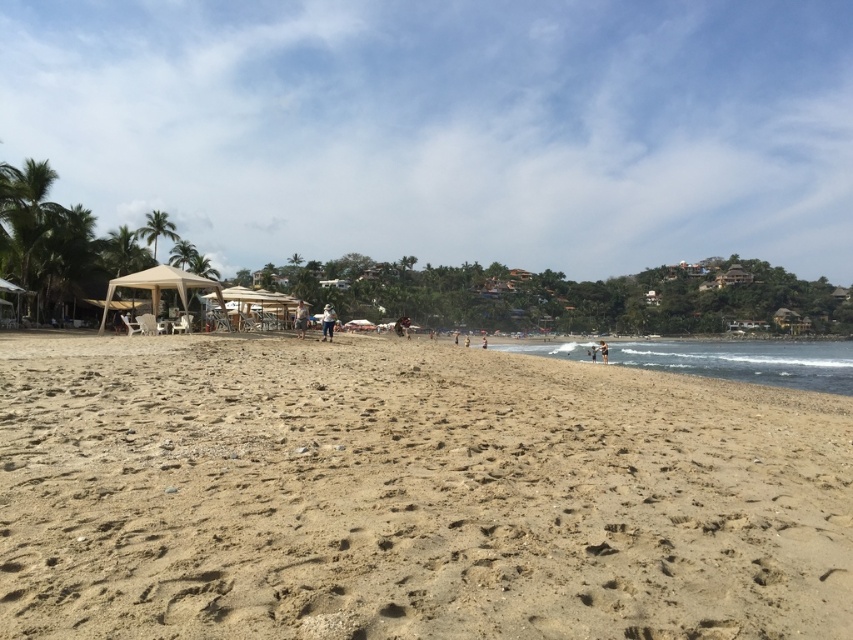
Question: In this image, where is light brown sand at center located relative to brown fabric umbrella at center?

Choices:
 (A) below
 (B) above

Answer: (B)

Question: Which object appears closest to the camera in this image?

Choices:
 (A) tan skin person at lower right
 (B) brown fabric umbrella at center
 (C) light brown sand at center

Answer: (B)

Question: Among these points, which one is farthest from the camera?

Choices:
 (A) (602, 344)
 (B) (331, 324)

Answer: (A)

Question: Does brown sandy beach at center have a smaller size compared to light brown sand at center?

Choices:
 (A) yes
 (B) no

Answer: (A)

Question: Is brown sandy beach at center smaller than tan skin person at lower right?

Choices:
 (A) no
 (B) yes

Answer: (B)

Question: Which of the following is the farthest from the observer?

Choices:
 (A) (302, 314)
 (B) (724, 440)
 (C) (328, 330)

Answer: (A)